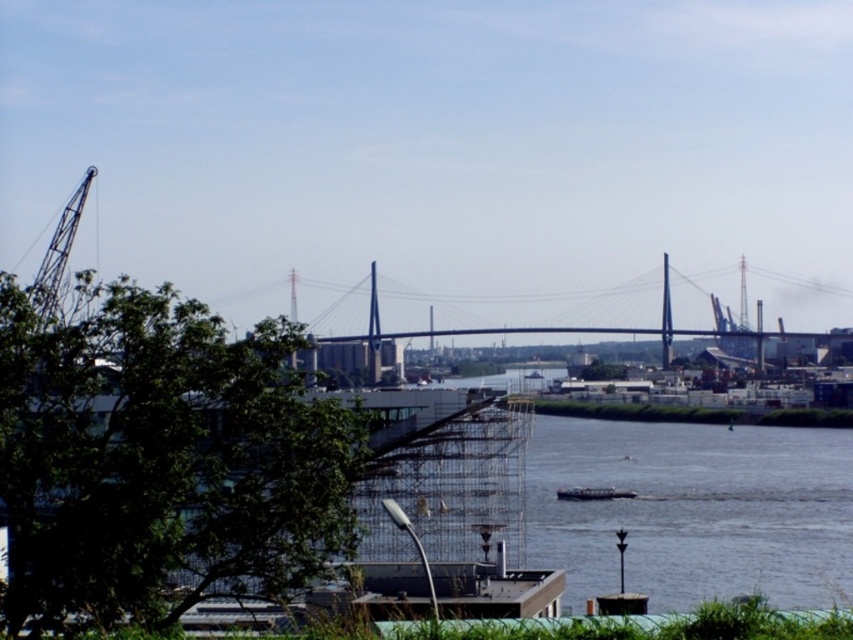
Question: Does green leafy tree at center appear on the left side of metallic gray crane at left?

Choices:
 (A) yes
 (B) no

Answer: (B)

Question: Which point is closer to the camera taking this photo?

Choices:
 (A) [595, 497]
 (B) [56, 257]

Answer: (B)

Question: Which of these objects is positioned farthest from the metallic gray crane at left?

Choices:
 (A) white plastic boat at center
 (B) green leafy tree at center

Answer: (A)

Question: Does green leafy tree at center appear over white plastic boat at center?

Choices:
 (A) yes
 (B) no

Answer: (A)

Question: Is metallic gray crane at left bigger than white plastic boat at center?

Choices:
 (A) yes
 (B) no

Answer: (A)

Question: Which point is closer to the camera taking this photo?

Choices:
 (A) (569, 499)
 (B) (209, 451)
 (C) (55, 301)

Answer: (B)